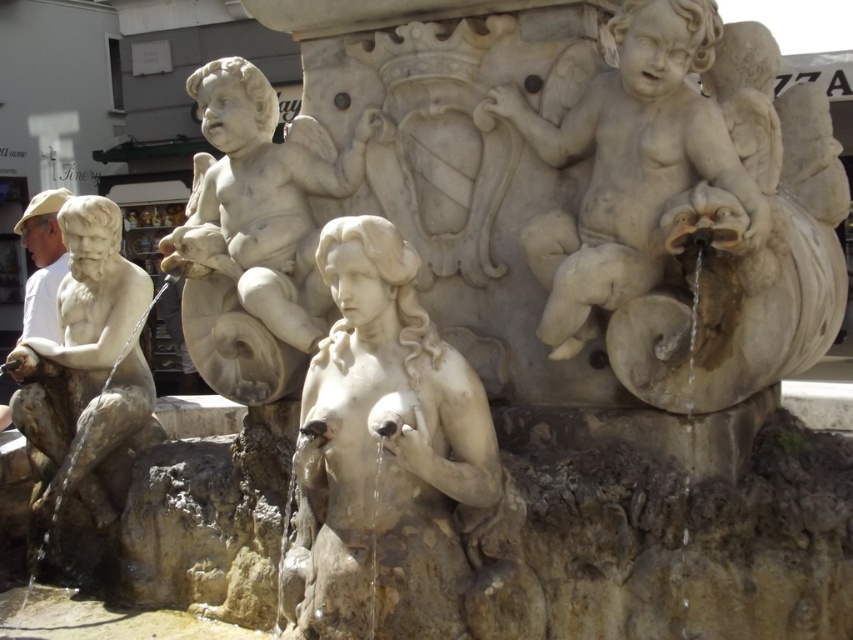
Question: Does white marble statue at center lie in front of white marble cherub at upper center?

Choices:
 (A) yes
 (B) no

Answer: (A)

Question: Which of these objects is positioned closest to the white marble cherub at upper right?

Choices:
 (A) matte stone man at left
 (B) white marble cherub at upper center
 (C) white marble statue at center

Answer: (C)

Question: Does white marble statue at center have a greater width compared to white marble cherub at upper center?

Choices:
 (A) yes
 (B) no

Answer: (B)

Question: Which of the following is the closest to the observer?

Choices:
 (A) matte stone man at left
 (B) white marble cherub at upper center

Answer: (B)

Question: Which object appears farthest from the camera in this image?

Choices:
 (A) white marble cherub at upper right
 (B) white marble cherub at upper center
 (C) white marble statue at center
 (D) matte stone man at left

Answer: (D)

Question: Is white marble cherub at upper right to the right of matte stone man at left from the viewer's perspective?

Choices:
 (A) yes
 (B) no

Answer: (A)